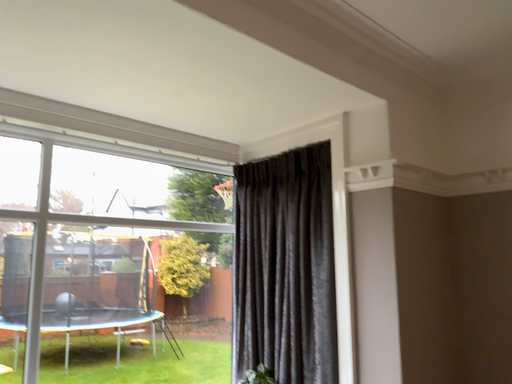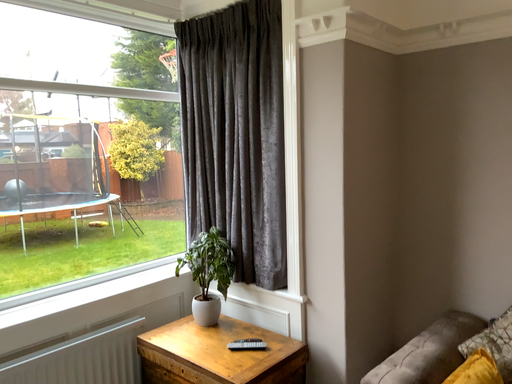
Question: How did the camera likely rotate when shooting the video?

Choices:
 (A) rotated right
 (B) rotated left

Answer: (A)